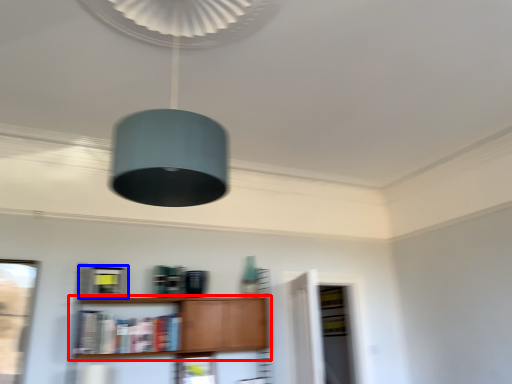
Question: Which of the following is the farthest to the observer, shelf (highlighted by a red box) or cabinetry (highlighted by a blue box)?

Choices:
 (A) shelf
 (B) cabinetry

Answer: (B)